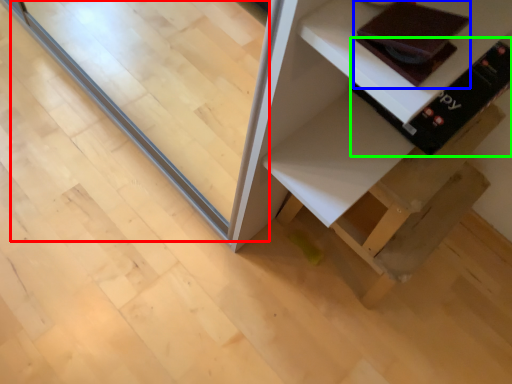
Question: Which is nearer to the glass door (highlighted by a red box)? book (highlighted by a blue box) or book (highlighted by a green box).

Choices:
 (A) book
 (B) book

Answer: (B)